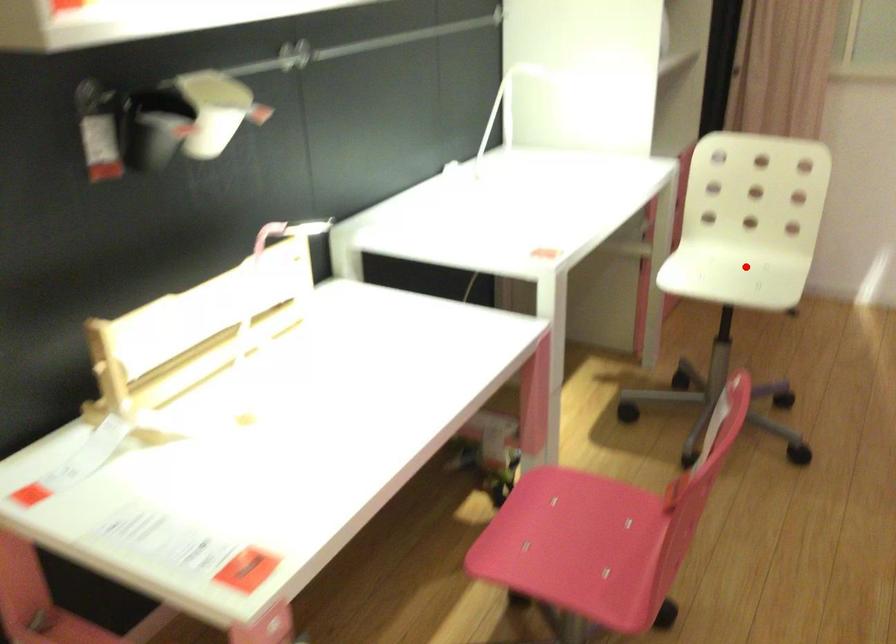
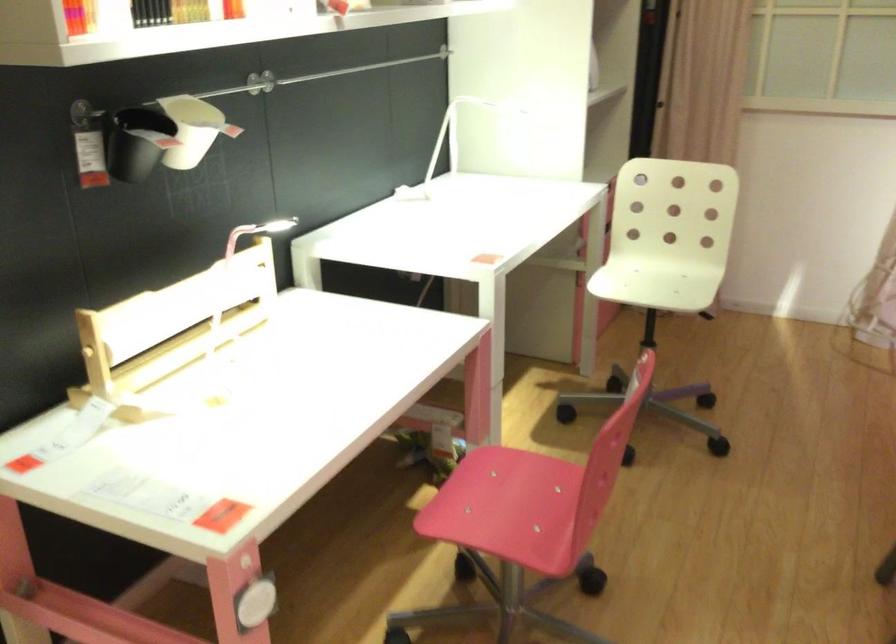
Question: I am providing you with two images of the same scene from different viewpoints. In image1, a red point is highlighted. Considering the same 3D point in image2, which of the following is correct?

Choices:
 (A) It is closer
 (B) It is farther

Answer: (B)